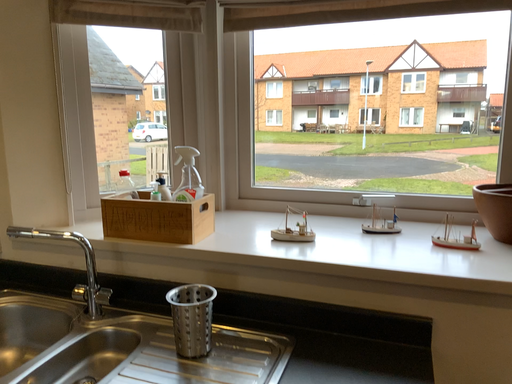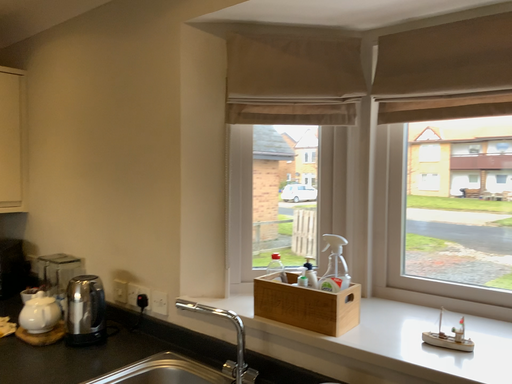
Question: How did the camera likely rotate when shooting the video?

Choices:
 (A) rotated right
 (B) rotated left

Answer: (B)